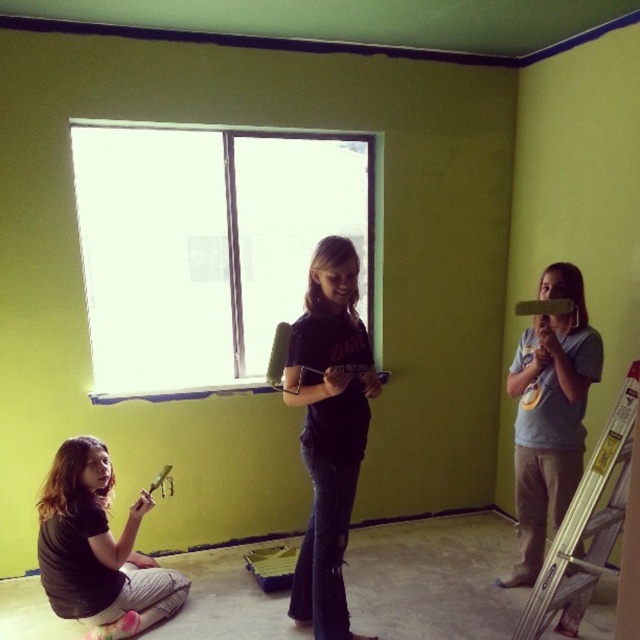
In the scene shown: You are one of the painters in the room. You need to reach the top of the silver metallic ladder at right to touch up a spot on the wall. However, there is a matte green paintbrush at lower left in the way. Can you move the ladder without disturbing the paintbrush?

The silver metallic ladder at right is in front of the matte green paintbrush at lower left, so moving the ladder would not disturb the paintbrush since it is already positioned in front of it.

You are a painter in the room. You need to move the matte green paintbrush at lower left to the silver metallic ladder at right. Which direction should you move it?

The silver metallic ladder at right is to the right of the matte green paintbrush at lower left, so you should move the matte green paintbrush at lower left to the right to reach the silver metallic ladder at right.